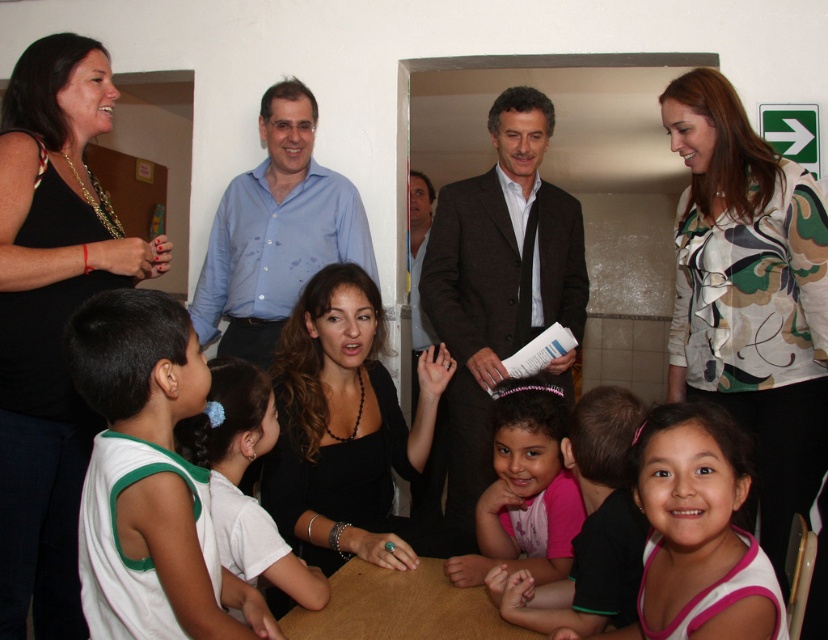
Is dark brown suit at center smaller than brown wooden table at center?

No, dark brown suit at center is not smaller than brown wooden table at center.

Is point (461, 500) closer to viewer compared to point (458, 625)?

No, (461, 500) is behind (458, 625).

Identify the location of dark brown suit at center. (498, 282).

Is blue shirt at center to the left of brown wooden table at center from the viewer's perspective?

Yes, blue shirt at center is to the left of brown wooden table at center.

Is blue shirt at center smaller than brown wooden table at center?

Actually, blue shirt at center might be larger than brown wooden table at center.

Who is more distant from viewer, [273,115] or [408,596]?

Positioned behind is point [273,115].

Locate an element on the screen. The width and height of the screenshot is (828, 640). blue shirt at center is located at coordinates (277, 232).

Measure the distance from black matte shirt at center to blue shirt at center.

black matte shirt at center is 56.15 centimeters from blue shirt at center.

Which of these two, black matte shirt at center or blue shirt at center, stands shorter?

Standing shorter between the two is black matte shirt at center.

Where is `black matte shirt at center`? The image size is (828, 640). black matte shirt at center is located at coordinates (343, 424).